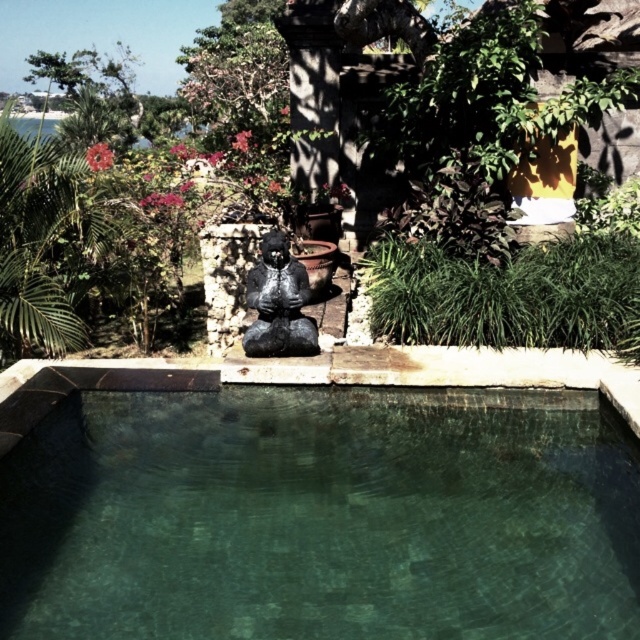
Between green mosaic tiles at center and black matte statue at center, which one appears on the left side from the viewer's perspective?

black matte statue at center

Is green mosaic tiles at center below black matte statue at center?

Yes.

Where is `green mosaic tiles at center`? The height and width of the screenshot is (640, 640). green mosaic tiles at center is located at coordinates (312, 509).

From the picture: Between green leafy plant at center and black matte statue at center, which one appears on the left side from the viewer's perspective?

Positioned to the left is black matte statue at center.

Is point (420, 93) farther from viewer compared to point (266, 324)?

Yes, point (420, 93) is farther from viewer.

Locate an element on the screen. This screenshot has height=640, width=640. green leafy plant at center is located at coordinates (488, 179).

Where is `green mosaic tiles at center`? The image size is (640, 640). green mosaic tiles at center is located at coordinates (312, 509).

Is green mosaic tiles at center to the right of green leafy plant at center from the viewer's perspective?

No, green mosaic tiles at center is not to the right of green leafy plant at center.

Between point (570, 636) and point (413, 230), which one is positioned in front?

Point (570, 636) is in front.

Locate an element on the screen. green mosaic tiles at center is located at coordinates (312, 509).